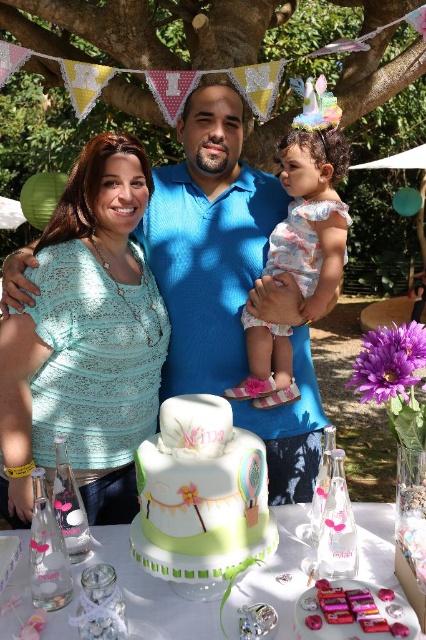
Consider the image. You are a photographer preparing to take a family photo. You notice the blue textured shirt at center and the floral fabric dress at center. Which clothing item should you adjust to ensure both are clearly visible in the frame?

The blue textured shirt at center is smaller than the floral fabric dress at center, so you should adjust the floral fabric dress at center to ensure both are clearly visible in the frame.